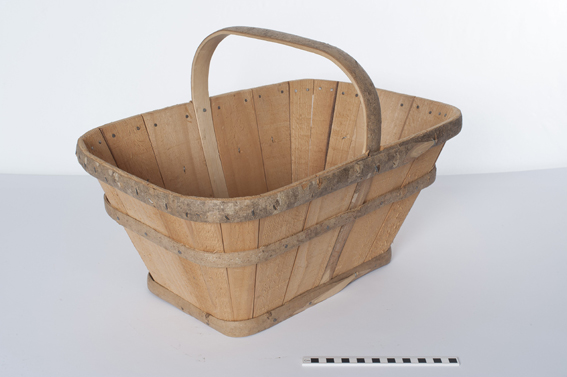
You are a GUI agent. You are given a task and a screenshot of the screen. Output one action in this format:
    pyautogui.click(x=<x>, y=<y>)
    Task: Click on the base of bucket
    Image resolution: width=567 pixels, height=377 pixels.
    Given the screenshot: What is the action you would take?
    pyautogui.click(x=300, y=307)